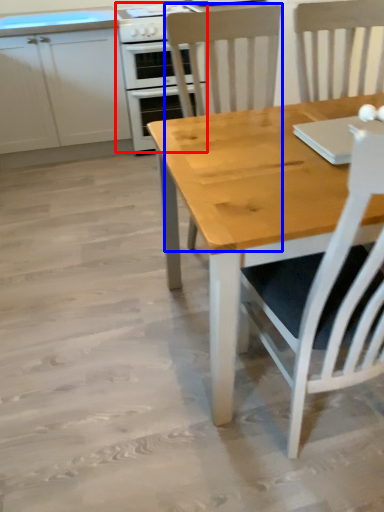
Question: Which object appears farthest to the camera in this image, kitchen appliance (highlighted by a red box) or chair (highlighted by a blue box)?

Choices:
 (A) kitchen appliance
 (B) chair

Answer: (A)